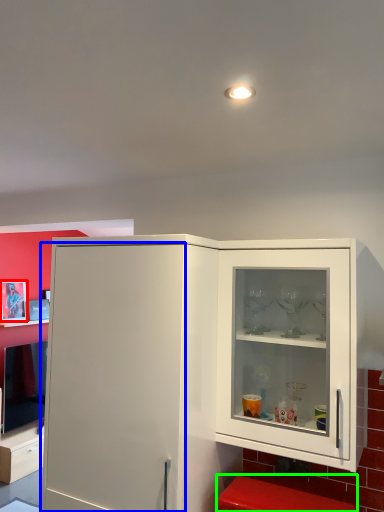
Question: Which object is positioned farthest from picture frame (highlighted by a red box)? Select from door (highlighted by a blue box) and step stool (highlighted by a green box).

Choices:
 (A) door
 (B) step stool

Answer: (B)